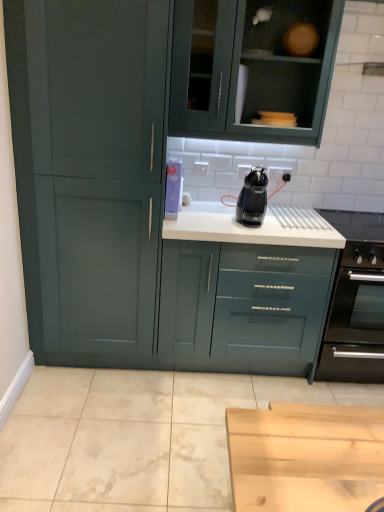
Question: Does matte green cupboard at left appear on the right side of black matte oven at right?

Choices:
 (A) yes
 (B) no

Answer: (B)

Question: Could black matte oven at right be considered to be inside matte green cupboard at left?

Choices:
 (A) yes
 (B) no

Answer: (B)

Question: Could you tell me if matte green cupboard at left is turned towards black matte oven at right?

Choices:
 (A) no
 (B) yes

Answer: (A)

Question: Does matte green cupboard at left appear on the left side of black matte oven at right?

Choices:
 (A) no
 (B) yes

Answer: (B)

Question: Is matte green cupboard at left bigger than black matte oven at right?

Choices:
 (A) no
 (B) yes

Answer: (B)

Question: Would you say matte green cupboard at left is a long distance from black matte oven at right?

Choices:
 (A) no
 (B) yes

Answer: (B)

Question: Is black plastic coffee machine at center shorter than matte green cupboard at left?

Choices:
 (A) yes
 (B) no

Answer: (A)

Question: From a real-world perspective, is black plastic coffee machine at center on matte green cupboard at left?

Choices:
 (A) no
 (B) yes

Answer: (B)

Question: From the image's perspective, is black plastic coffee machine at center on matte green cupboard at left?

Choices:
 (A) yes
 (B) no

Answer: (B)

Question: Can we say black plastic coffee machine at center lies outside matte green cupboard at left?

Choices:
 (A) no
 (B) yes

Answer: (B)

Question: Is there a large distance between black plastic coffee machine at center and matte green cupboard at left?

Choices:
 (A) no
 (B) yes

Answer: (A)

Question: Can you confirm if black plastic coffee machine at center is wider than matte green cupboard at left?

Choices:
 (A) yes
 (B) no

Answer: (B)

Question: Is black plastic coffee machine at center at the back of matte green cupboard at left?

Choices:
 (A) no
 (B) yes

Answer: (A)